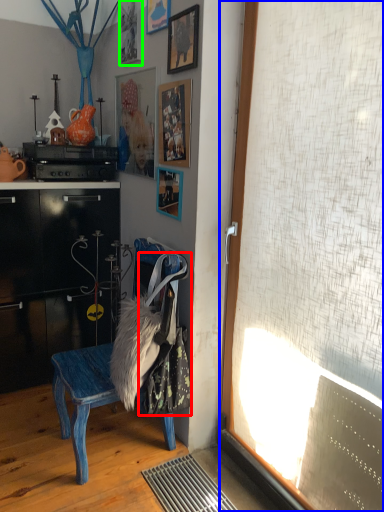
Question: Estimate the real-world distances between objects in this image. Which object is farther from laundry (highlighted by a red box), window screen (highlighted by a blue box) or picture frame (highlighted by a green box)?

Choices:
 (A) window screen
 (B) picture frame

Answer: (B)